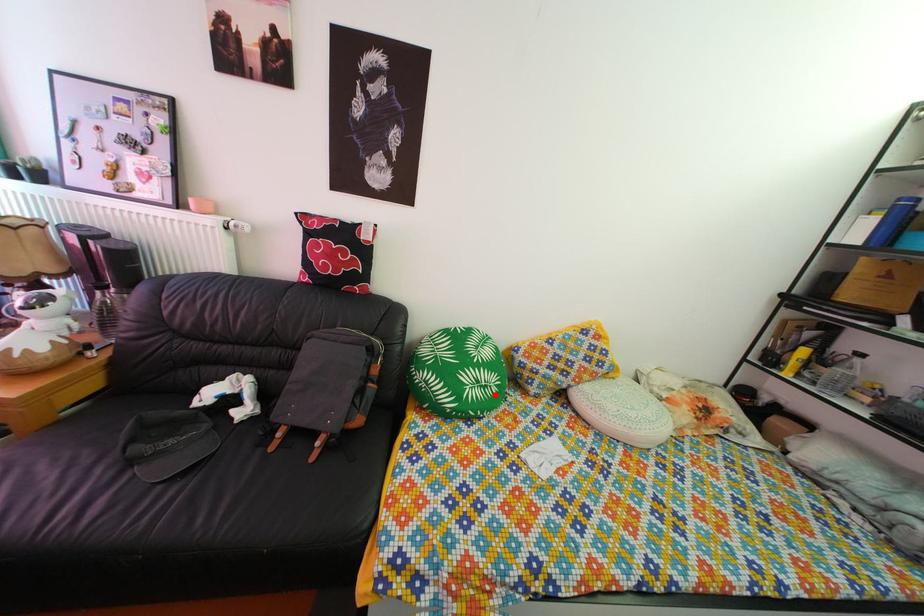
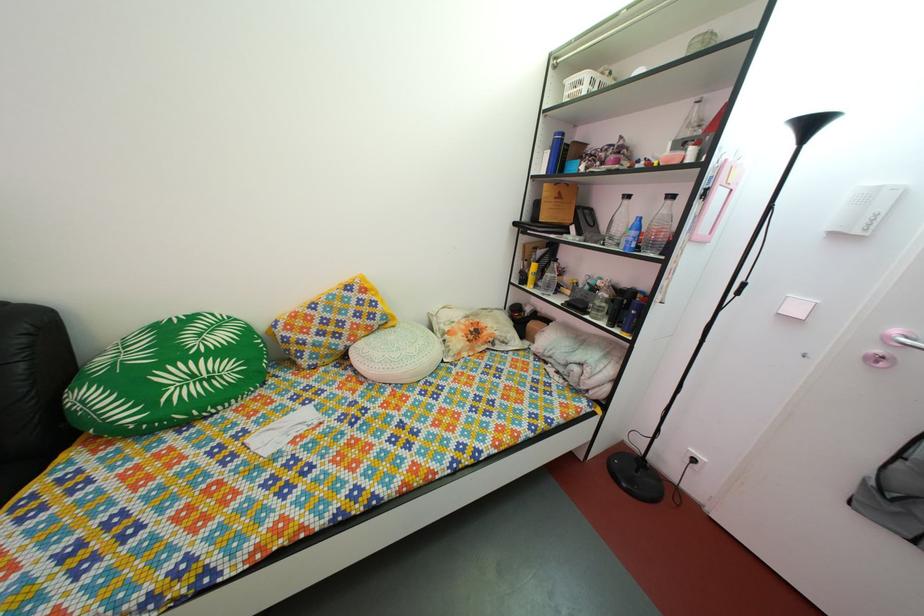
Find the pixel in the second image that matches the highlighted location in the first image.

(220, 387)